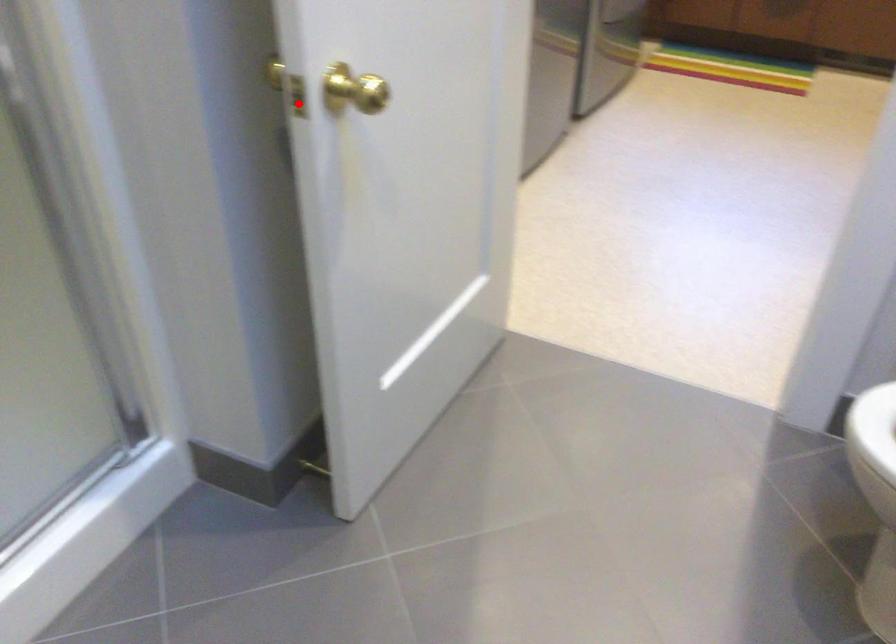
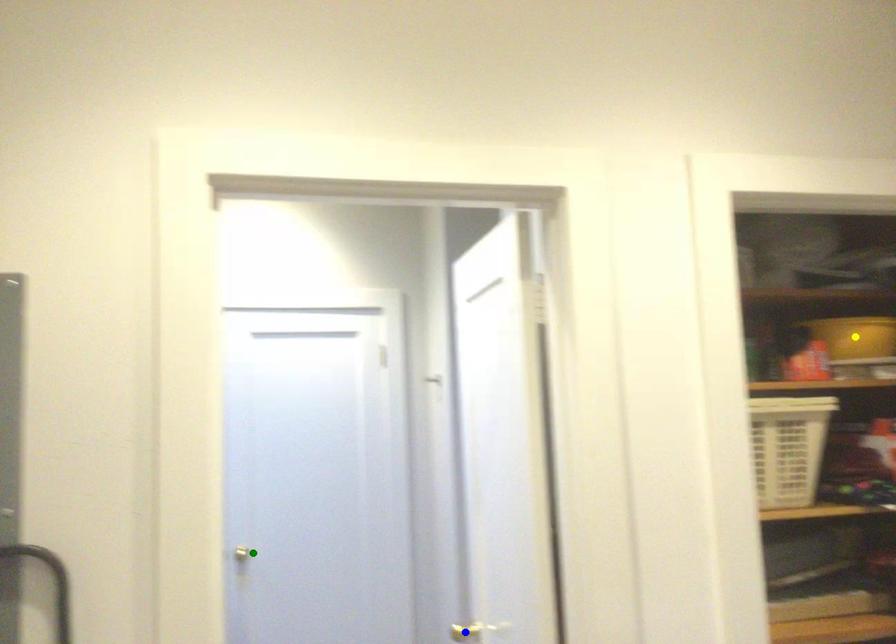
Question: I am providing you with two images of the same scene from different viewpoints. A red point is marked on the first image. You are given multiple points on the second image. Can you choose the point in image 2 that corresponds to the point in image 1?

Choices:
 (A) yellow point
 (B) blue point
 (C) green point

Answer: (B)